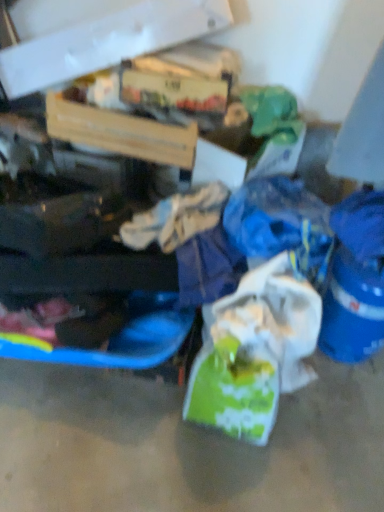
Question: From a real-world perspective, is white matte plastic bag at center located higher than cardboard box at upper left, arranged as the second box when ordered from the bottom?

Choices:
 (A) no
 (B) yes

Answer: (A)

Question: Does white matte plastic bag at center have a greater height compared to cardboard box at upper left, arranged as the second box when ordered from the bottom?

Choices:
 (A) yes
 (B) no

Answer: (B)

Question: Is white matte plastic bag at center wider than cardboard box at upper left, acting as the first box starting from the top?

Choices:
 (A) yes
 (B) no

Answer: (B)

Question: Does white matte plastic bag at center come behind cardboard box at upper left, arranged as the second box when ordered from the bottom?

Choices:
 (A) yes
 (B) no

Answer: (B)

Question: Is white matte plastic bag at center in front of cardboard box at upper left, arranged as the second box when ordered from the bottom?

Choices:
 (A) no
 (B) yes

Answer: (B)

Question: Is point (x=382, y=326) positioned closer to the camera than point (x=299, y=310)?

Choices:
 (A) closer
 (B) farther

Answer: (B)

Question: Is blue plastic bucket at lower right wider or thinner than white matte plastic bag at center?

Choices:
 (A) thin
 (B) wide

Answer: (A)

Question: From their relative heights in the image, would you say blue plastic bucket at lower right is taller or shorter than white matte plastic bag at center?

Choices:
 (A) short
 (B) tall

Answer: (B)

Question: From the image's perspective, relative to white matte plastic bag at center, is blue plastic bucket at lower right above or below?

Choices:
 (A) above
 (B) below

Answer: (A)

Question: From a real-world perspective, is white matte plastic bag at center physically located above or below blue plastic bucket at lower right?

Choices:
 (A) below
 (B) above

Answer: (A)

Question: Is white matte plastic bag at center to the left or to the right of blue plastic bucket at lower right in the image?

Choices:
 (A) right
 (B) left

Answer: (B)

Question: Considering the positions of white matte plastic bag at center and blue plastic bucket at lower right in the image, is white matte plastic bag at center taller or shorter than blue plastic bucket at lower right?

Choices:
 (A) tall
 (B) short

Answer: (B)

Question: Is point (241, 352) positioned closer to the camera than point (327, 333)?

Choices:
 (A) farther
 (B) closer

Answer: (B)

Question: Is blue plastic bucket at lower right wider or thinner than cardboard box at upper left, acting as the first box starting from the top?

Choices:
 (A) thin
 (B) wide

Answer: (A)

Question: Would you say blue plastic bucket at lower right is to the left or to the right of cardboard box at upper left, arranged as the second box when ordered from the bottom, in the picture?

Choices:
 (A) left
 (B) right

Answer: (B)